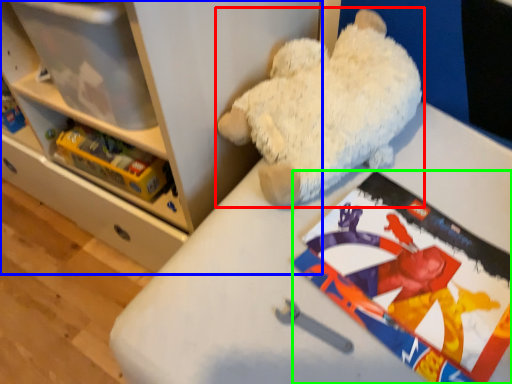
Question: Estimate the real-world distances between objects in this image. Which object is farther from teddy bear (highlighted by a red box), shelf (highlighted by a blue box) or comic book (highlighted by a green box)?

Choices:
 (A) shelf
 (B) comic book

Answer: (A)